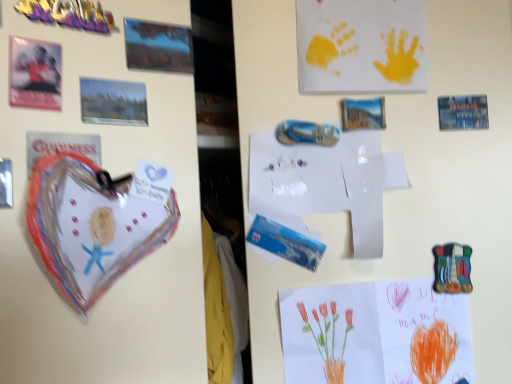
Question: Considering the relative sizes of matte plastic postcard at upper left, the third postcard ordered from the bottom, and yellow paper handprints at upper center, which ranks as the 2th postcard in right-to-left order, in the image provided, is matte plastic postcard at upper left, the third postcard ordered from the bottom, bigger than yellow paper handprints at upper center, which ranks as the 2th postcard in right-to-left order,?

Choices:
 (A) yes
 (B) no

Answer: (B)

Question: From a real-world perspective, is matte plastic postcard at upper left, the third postcard ordered from the bottom, under yellow paper handprints at upper center, which ranks as the 2th postcard in right-to-left order?

Choices:
 (A) yes
 (B) no

Answer: (A)

Question: From the image's perspective, is matte plastic postcard at upper left, acting as the first postcard starting from the front, located beneath yellow paper handprints at upper center, which ranks as the 2th postcard in right-to-left order?

Choices:
 (A) no
 (B) yes

Answer: (B)

Question: Can you confirm if matte plastic postcard at upper left, acting as the first postcard starting from the front, is shorter than yellow paper handprints at upper center, the 4th postcard viewed from the left?

Choices:
 (A) yes
 (B) no

Answer: (A)

Question: Is matte plastic postcard at upper left, acting as the first postcard starting from the front, positioned behind yellow paper handprints at upper center, the 4th postcard viewed from the left?

Choices:
 (A) no
 (B) yes

Answer: (A)

Question: Considering the relative positions of matte plastic postcard at upper left, which ranks as the 5th postcard in back-to-front order, and yellow paper handprints at upper center, the 4th postcard viewed from the left, in the image provided, is matte plastic postcard at upper left, which ranks as the 5th postcard in back-to-front order, to the right of yellow paper handprints at upper center, the 4th postcard viewed from the left, from the viewer's perspective?

Choices:
 (A) no
 (B) yes

Answer: (A)

Question: From the image's perspective, is matte plastic postcard at upper left, acting as the first postcard starting from the front, on top of white paper at center?

Choices:
 (A) yes
 (B) no

Answer: (A)

Question: Would you say matte plastic postcard at upper left, the third postcard ordered from the bottom, is outside white paper at center?

Choices:
 (A) yes
 (B) no

Answer: (A)

Question: Is matte plastic postcard at upper left, the third postcard positioned from the top, positioned behind white paper at center?

Choices:
 (A) yes
 (B) no

Answer: (B)

Question: Considering the relative sizes of matte plastic postcard at upper left, acting as the first postcard starting from the front, and white paper at center in the image provided, is matte plastic postcard at upper left, acting as the first postcard starting from the front, bigger than white paper at center?

Choices:
 (A) yes
 (B) no

Answer: (B)

Question: Does matte plastic postcard at upper left, which ranks as the 5th postcard in back-to-front order, have a lesser height compared to white paper at center?

Choices:
 (A) yes
 (B) no

Answer: (A)

Question: Can you confirm if matte plastic postcard at upper left, the third postcard positioned from the top, is taller than white paper at center?

Choices:
 (A) no
 (B) yes

Answer: (A)

Question: Is watercolor paper flowers at lower right, which is the fifth postcard in top-to-bottom order, looking in the opposite direction of matte plastic postcard at upper left, the third postcard ordered from the bottom?

Choices:
 (A) no
 (B) yes

Answer: (A)